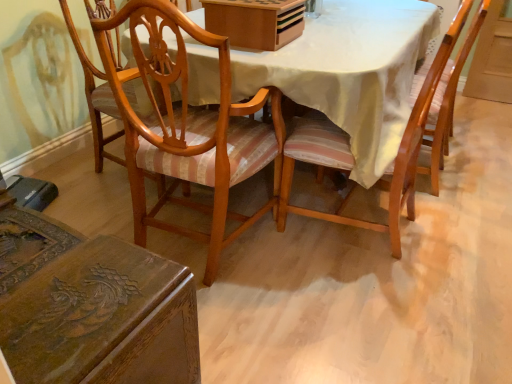
Question: From the image's perspective, is wooden chair with striped cushion at center, which appears as the third chair when viewed from the left, located above or below wooden chair with striped cushion at center, placed as the second chair when sorted from left to right?

Choices:
 (A) below
 (B) above

Answer: (B)

Question: Considering the positions of point (316, 132) and point (202, 168), is point (316, 132) closer or farther from the camera than point (202, 168)?

Choices:
 (A) farther
 (B) closer

Answer: (A)

Question: Which of these objects is positioned farthest from the polished wood chair at lower left, the third chair in the right-to-left sequence?

Choices:
 (A) wooden chair with striped cushion at center, the first chair from the right
 (B) wooden box at upper center
 (C) wooden chair with striped cushion at center, placed as the second chair when sorted from left to right

Answer: (B)

Question: Estimate the real-world distances between objects in this image. Which object is farther from the wooden chair with striped cushion at center, the first chair from the right?

Choices:
 (A) wooden box at upper center
 (B) wooden chair with striped cushion at center, positioned as the 2th chair in right-to-left order
 (C) polished wood chair at lower left, which is the 1th chair from left to right

Answer: (C)